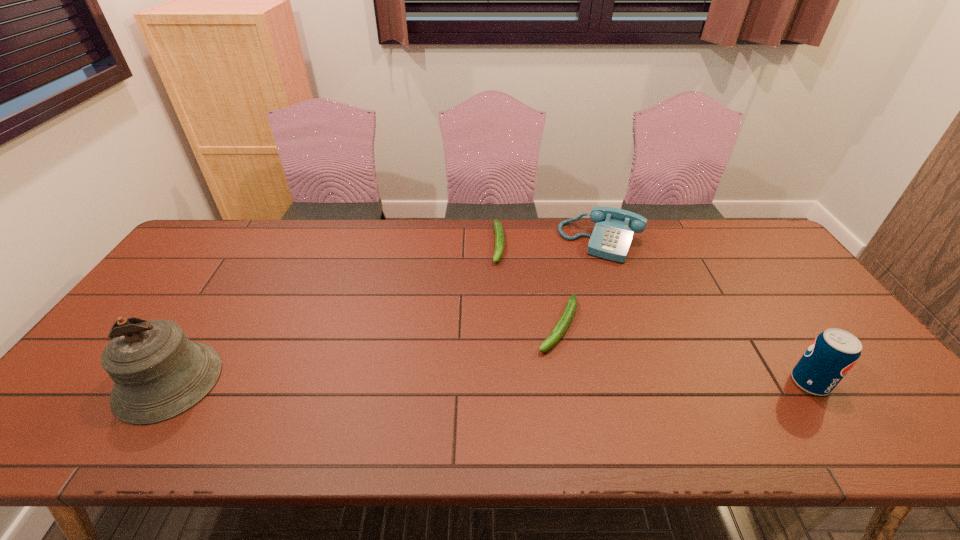
This screenshot has width=960, height=540. Identify the location of the tallest object. 158,373.

You are a GUI agent. You are given a task and a screenshot of the screen. Output one action in this format:
    pyautogui.click(x=<x>, y=<y>)
    Task: Click on the bell
    The image size is (960, 540).
    Given the screenshot: What is the action you would take?
    pyautogui.click(x=158, y=373)

What are the coordinates of `the rightmost object` in the screenshot? It's located at (831, 355).

I want to click on the second tallest object, so click(x=831, y=355).

Image resolution: width=960 pixels, height=540 pixels. Identify the location of the farther zucchini. [x=498, y=228].

Find the location of a particular element. The image size is (960, 540). the left zucchini is located at coordinates (498, 228).

You are a GUI agent. You are given a task and a screenshot of the screen. Output one action in this format:
    pyautogui.click(x=<x>, y=<y>)
    Task: Click on the nearer zucchini
    
    Given the screenshot: What is the action you would take?
    pyautogui.click(x=563, y=323)

This screenshot has width=960, height=540. I want to click on telephone, so click(x=611, y=238).

The image size is (960, 540). What are the coordinates of `vacant space located 0.120m on the back of the tallest object` in the screenshot? It's located at (214, 311).

Locate an element on the screen. Image resolution: width=960 pixels, height=540 pixels. blank space located on the back of the second tallest object is located at coordinates (750, 294).